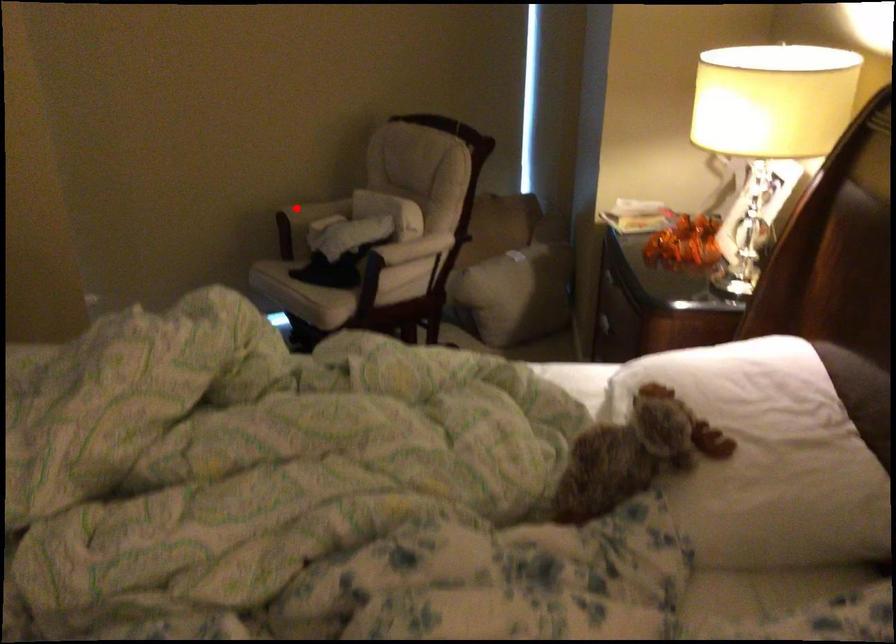
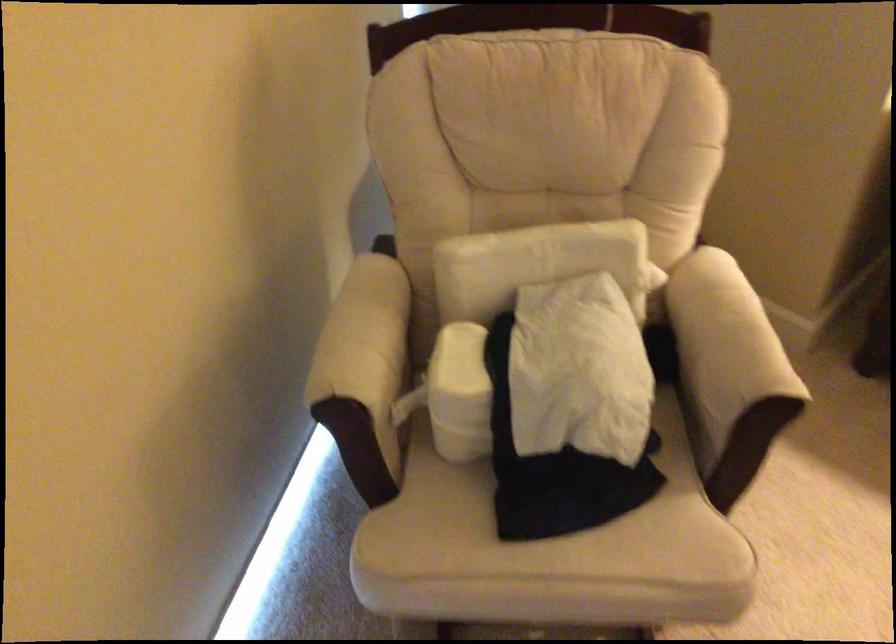
The point at the highlighted location is marked in the first image. Where is the corresponding point in the second image?

(364, 373)